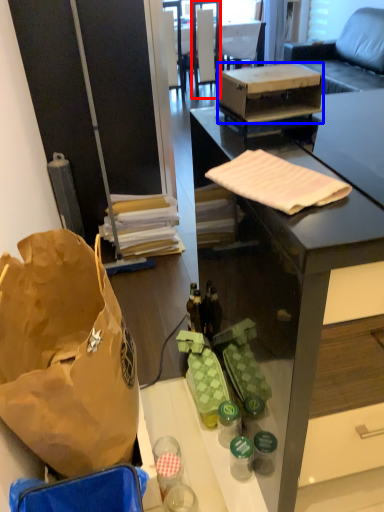
Question: Which of the following is the farthest to the observer, chair (highlighted by a red box) or box (highlighted by a blue box)?

Choices:
 (A) chair
 (B) box

Answer: (A)